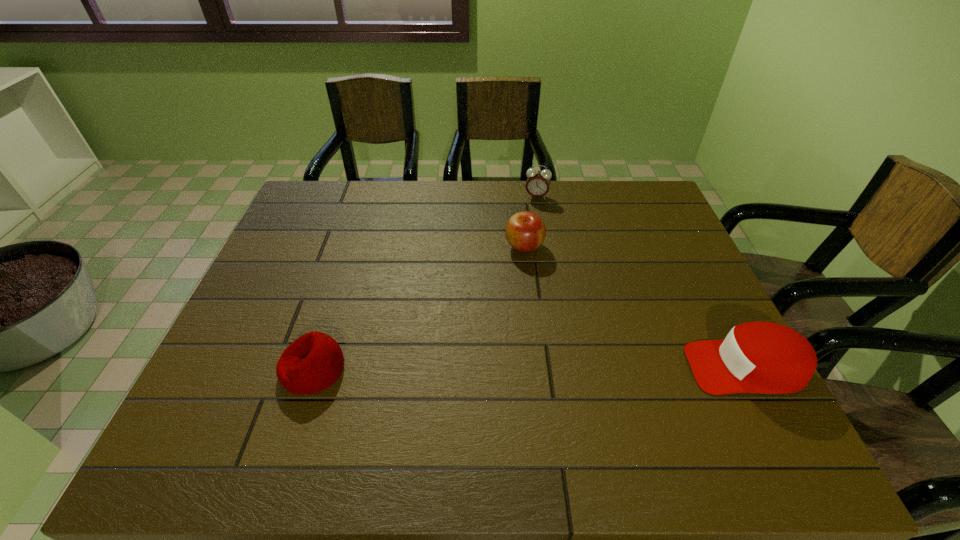
The height and width of the screenshot is (540, 960). What are the coordinates of `vacant space on the desktop that is between the leftmost object and the rightmost object and is positioned on the stem of the third nearest object` in the screenshot? It's located at (492, 368).

The height and width of the screenshot is (540, 960). Find the location of `free spot on the desktop that is between the beanbag and the rightmost object and is positioned on the clock face of the farthest object`. free spot on the desktop that is between the beanbag and the rightmost object and is positioned on the clock face of the farthest object is located at coordinates (499, 368).